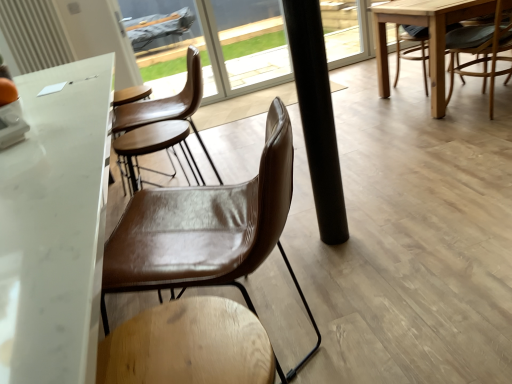
Identify the location of free location to the right of black matte pole at center. (372, 223).